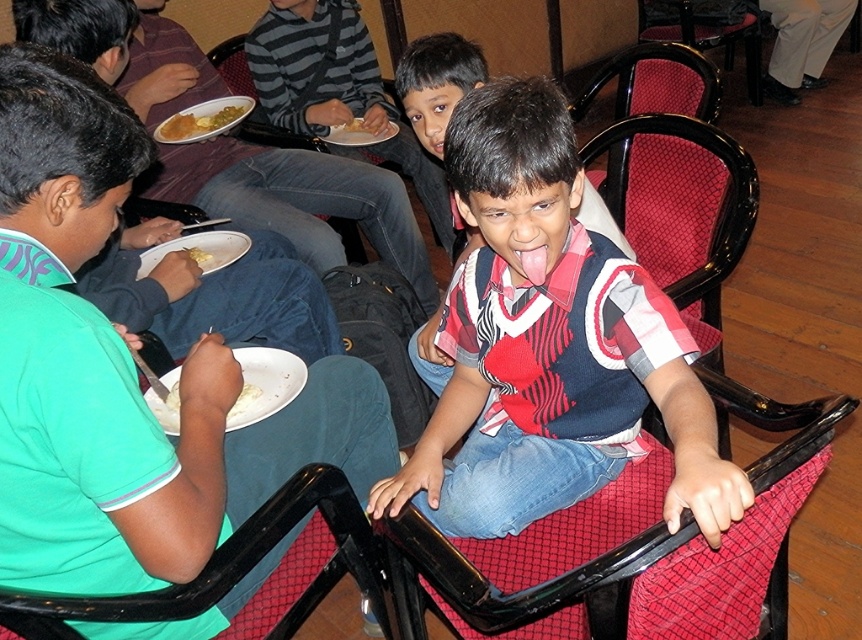
Question: Does black plastic chair at center have a smaller size compared to white matte plate at lower center?

Choices:
 (A) no
 (B) yes

Answer: (A)

Question: Does matte blue shirt at center have a greater width compared to yellowish matte bread at center?

Choices:
 (A) yes
 (B) no

Answer: (A)

Question: Which point is farther from the camera taking this photo?

Choices:
 (A) (578, 636)
 (B) (195, 259)
 (C) (482, 454)
 (D) (719, 1)

Answer: (D)

Question: Does velvet-like red chair at center have a smaller size compared to yellow matte rice at upper left?

Choices:
 (A) no
 (B) yes

Answer: (A)

Question: Which object is positioned closest to the yellow matte rice at upper left?

Choices:
 (A) white matte plate at lower left
 (B) printed cotton shirt at center
 (C) black plastic chair at center
 (D) red mesh chair at center

Answer: (C)

Question: Estimate the real-world distances between objects in this image. Which object is closer to the black plastic chair at center?

Choices:
 (A) printed cotton shirt at center
 (B) velvet-like red chair at center
 (C) white matte plate at lower left
 (D) yellow matte bread at center

Answer: (D)